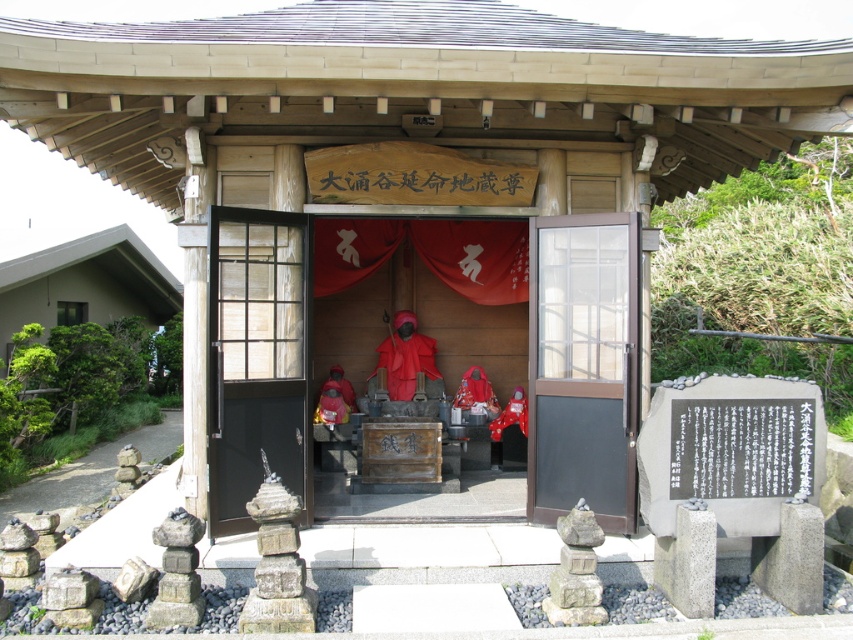
Question: Which object is positioned closest to the black glass door at center?

Choices:
 (A) green matte house at left
 (B) brown wooden door at center

Answer: (B)

Question: Does brown wooden door at center have a greater width compared to matte red statue at center?

Choices:
 (A) yes
 (B) no

Answer: (A)

Question: Does green matte house at left appear under red matte statue at center?

Choices:
 (A) no
 (B) yes

Answer: (A)

Question: Considering the real-world distances, which object is closest to the brown wooden door at center?

Choices:
 (A) matte red statue at center
 (B) red matte statue at center
 (C) green matte house at left

Answer: (B)

Question: Does brown wooden door at center appear on the right side of matte red statue at center?

Choices:
 (A) yes
 (B) no

Answer: (A)

Question: Considering the real-world distances, which object is farthest from the brown wooden door at center?

Choices:
 (A) matte red statue at center
 (B) green matte house at left
 (C) black glass door at center

Answer: (B)